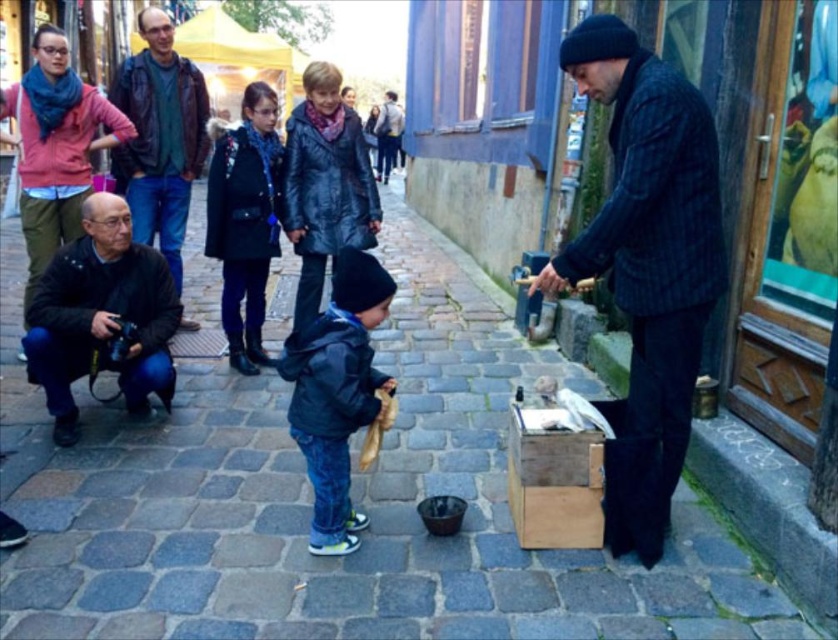
Question: Does dark blue textured jacket at right appear under black leather jacket at center?

Choices:
 (A) yes
 (B) no

Answer: (A)

Question: Which object appears closest to the camera in this image?

Choices:
 (A) black leather jacket at lower left
 (B) black leather jacket at center
 (C) dark blue denim jacket at center
 (D) smooth cobblestone pavement at center

Answer: (D)

Question: Which point is farther to the camera?

Choices:
 (A) smooth cobblestone pavement at center
 (B) leather jacket at upper left

Answer: (B)

Question: Can you confirm if black leather jacket at lower left is positioned above leather jacket at upper left?

Choices:
 (A) yes
 (B) no

Answer: (B)

Question: Among these objects, which one is nearest to the camera?

Choices:
 (A) dark blue denim jacket at center
 (B) dark blue textured jacket at right
 (C) leather jacket at upper left

Answer: (B)

Question: Can you confirm if dark blue textured jacket at right is positioned below black leather jacket at lower left?

Choices:
 (A) yes
 (B) no

Answer: (B)